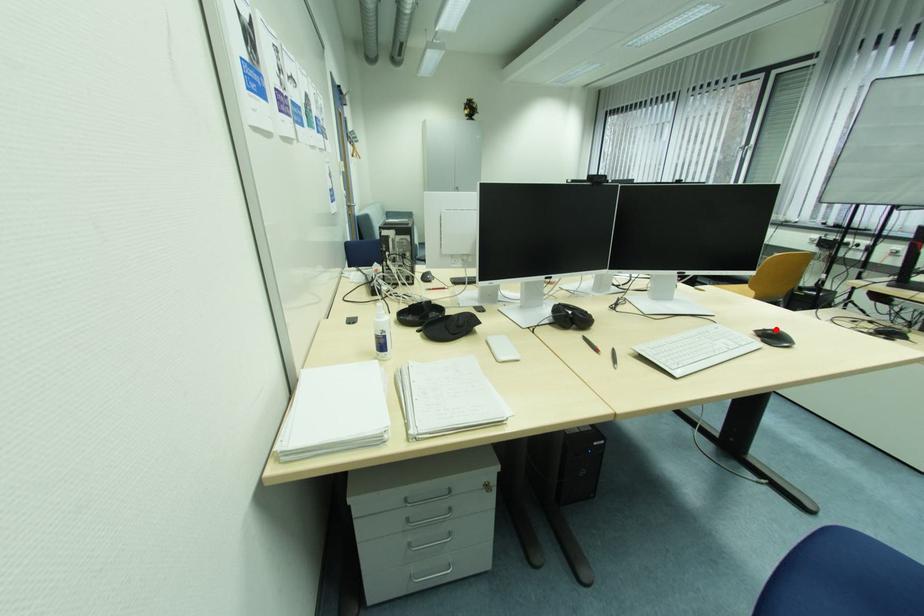
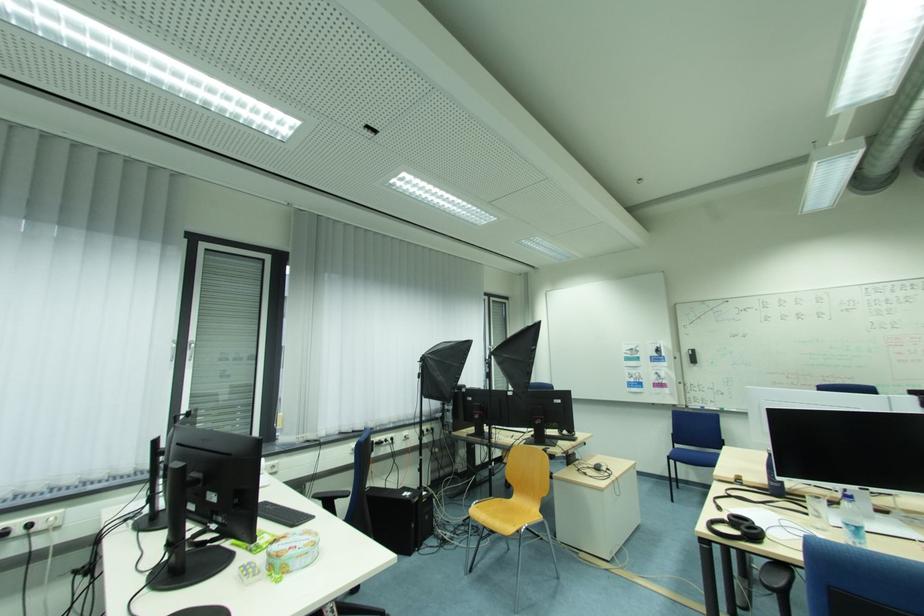
Question: I am providing you with two images of the same scene from different viewpoints. A red point is marked on the first image. Can you still see the location of the red point in image 2?

Choices:
 (A) Yes
 (B) No

Answer: (B)